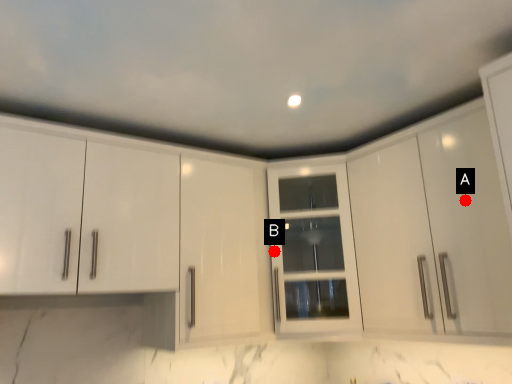
Question: Two points are circled on the image, labeled by A and B beside each circle. Which point is farther to the camera?

Choices:
 (A) A is further
 (B) B is further

Answer: (B)